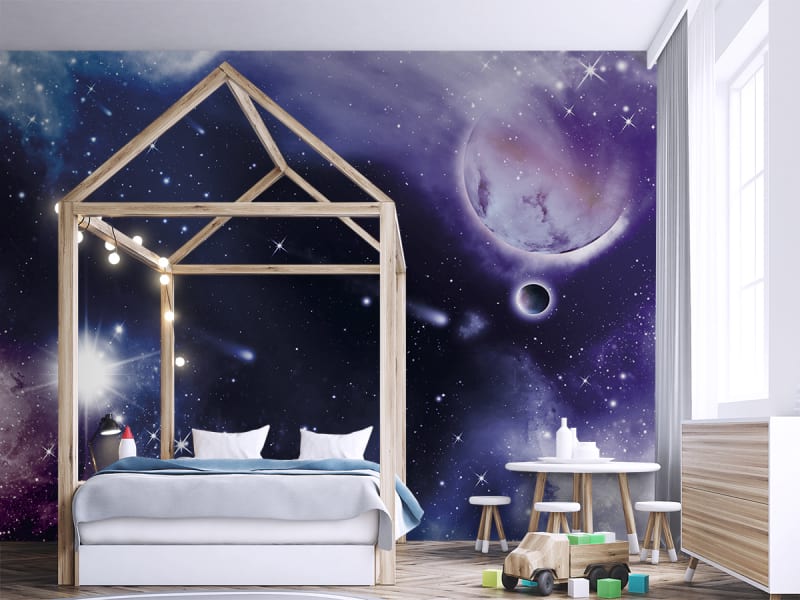
Locate an element on the screen. The image size is (800, 600). black lamp is located at coordinates (108, 428).